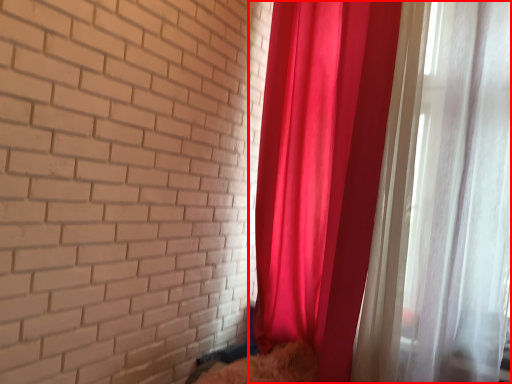
Question: Where is curtain (annotated by the red box) located in relation to animal in the image?

Choices:
 (A) right
 (B) left

Answer: (A)